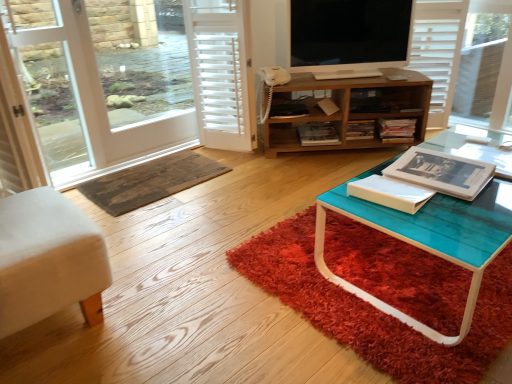
Find the location of a particular element. Image resolution: width=512 pixels, height=384 pixels. black glossy tv at upper center is located at coordinates (349, 33).

This screenshot has height=384, width=512. What do you see at coordinates (349, 33) in the screenshot?
I see `black glossy tv at upper center` at bounding box center [349, 33].

This screenshot has width=512, height=384. What do you see at coordinates (375, 309) in the screenshot? I see `shaggy red rug at lower center, marked as the first doormat in a front-to-back arrangement` at bounding box center [375, 309].

Locate an element on the screen. wooden textured doormat at center, which is the second doormat in front-to-back order is located at coordinates (150, 181).

The image size is (512, 384). Describe the element at coordinates (47, 259) in the screenshot. I see `white fabric cushion at lower left` at that location.

Identify the location of wooden cabinet at center. The height and width of the screenshot is (384, 512). (348, 109).

Between wooden textured doormat at center, which appears as the 1th doormat when viewed from the back, and black glossy tv at upper center, which one appears on the left side from the viewer's perspective?

wooden textured doormat at center, which appears as the 1th doormat when viewed from the back.

Are wooden textured doormat at center, marked as the first doormat in a left-to-right arrangement, and black glossy tv at upper center located far from each other?

Absolutely, wooden textured doormat at center, marked as the first doormat in a left-to-right arrangement, is distant from black glossy tv at upper center.

Is wooden textured doormat at center, which appears as the 1th doormat when viewed from the back, looking in the opposite direction of black glossy tv at upper center?

No, wooden textured doormat at center, which appears as the 1th doormat when viewed from the back, is not facing away from black glossy tv at upper center.

Is wooden textured doormat at center, the second doormat when ordered from right to left, positioned before black glossy tv at upper center?

Yes, the depth of wooden textured doormat at center, the second doormat when ordered from right to left, is less than that of black glossy tv at upper center.

Is transparent glass screen door at left wider than shaggy red rug at lower center, the first doormat positioned from the right?

No.

You are a GUI agent. You are given a task and a screenshot of the screen. Output one action in this format:
    pyautogui.click(x=<x>, y=<y>)
    Task: Click on the screen door that appears on the left of shaggy red rug at lower center, the first doormat positioned from the right
    
    Given the screenshot: What is the action you would take?
    pyautogui.click(x=48, y=84)

Between point (42, 25) and point (404, 283), which one is positioned in front?

The point (404, 283) is closer to the camera.

Is shaggy red rug at lower center, which is counted as the 2th doormat, starting from the back, surrounded by transparent glass screen door at left?

Actually, shaggy red rug at lower center, which is counted as the 2th doormat, starting from the back, is outside transparent glass screen door at left.

How many degrees apart are the facing directions of shaggy red rug at lower center, which is counted as the 2th doormat, starting from the back, and white fabric cushion at lower left?

The angle between the facing direction of shaggy red rug at lower center, which is counted as the 2th doormat, starting from the back, and the facing direction of white fabric cushion at lower left is 4.48 degrees.

Based on the photo, from the image's perspective, is shaggy red rug at lower center, marked as the first doormat in a front-to-back arrangement, on top of white fabric cushion at lower left?

Yes, from the image's perspective, shaggy red rug at lower center, marked as the first doormat in a front-to-back arrangement, is above white fabric cushion at lower left.

Does shaggy red rug at lower center, marked as the first doormat in a front-to-back arrangement, have a larger size compared to white fabric cushion at lower left?

Actually, shaggy red rug at lower center, marked as the first doormat in a front-to-back arrangement, might be smaller than white fabric cushion at lower left.

From a real-world perspective, between shaggy red rug at lower center, marked as the first doormat in a front-to-back arrangement, and white fabric cushion at lower left, who is vertically higher?

From a 3D spatial view, white fabric cushion at lower left is above.

Which is closer, (55, 193) or (358, 60)?

The point (55, 193) is closer.

Is white fabric cushion at lower left wider or thinner than black glossy tv at upper center?

In the image, white fabric cushion at lower left appears to be wider than black glossy tv at upper center.

From the image's perspective, is white fabric cushion at lower left above black glossy tv at upper center?

No, from the image's perspective, white fabric cushion at lower left is not over black glossy tv at upper center.

From a real-world perspective, is white fabric cushion at lower left under black glossy tv at upper center?

Yes.

Which object is further away from the camera taking this photo, black glossy tv at upper center or wooden cabinet at center?

wooden cabinet at center is behind.

Consider the image. Is black glossy tv at upper center facing towards wooden cabinet at center?

No, black glossy tv at upper center is not oriented towards wooden cabinet at center.

Which object is thinner, black glossy tv at upper center or wooden cabinet at center?

Thinner between the two is black glossy tv at upper center.

Can you tell me how much black glossy tv at upper center and wooden cabinet at center differ in facing direction?

The angular difference between black glossy tv at upper center and wooden cabinet at center is 1.94 degrees.

Considering the sizes of objects wooden cabinet at center and wooden textured doormat at center, marked as the first doormat in a left-to-right arrangement, in the image provided, who is shorter, wooden cabinet at center or wooden textured doormat at center, marked as the first doormat in a left-to-right arrangement,?

wooden textured doormat at center, marked as the first doormat in a left-to-right arrangement.

Does point (300, 99) come closer to viewer compared to point (142, 167)?

No, (300, 99) is behind (142, 167).

Is wooden cabinet at center positioned beyond the bounds of wooden textured doormat at center, marked as the first doormat in a left-to-right arrangement?

Indeed, wooden cabinet at center is completely outside wooden textured doormat at center, marked as the first doormat in a left-to-right arrangement.

How different are the orientations of transparent glass screen door at left and black glossy tv at upper center in degrees?

There is a 39-degree angle between the facing directions of transparent glass screen door at left and black glossy tv at upper center.

Is point (67, 41) behind point (374, 7)?

No.

Based on their positions, is transparent glass screen door at left located to the left or right of black glossy tv at upper center?

Based on their positions, transparent glass screen door at left is located to the left of black glossy tv at upper center.

Is the depth of transparent glass screen door at left less than that of black glossy tv at upper center?

Yes, it is in front of black glossy tv at upper center.

Locate an element on the screen. The width and height of the screenshot is (512, 384). television lying behind the wooden textured doormat at center, the second doormat when ordered from right to left is located at coordinates (349, 33).

The width and height of the screenshot is (512, 384). There is a transparent glass screen door at left. In order to click on the 2nd doormat below it (from the image's perspective) in this screenshot , I will do `click(375, 309)`.

Considering their positions, is wooden cabinet at center positioned closer to shaggy red rug at lower center, marked as the first doormat in a front-to-back arrangement, than transparent glass screen door at left?

Among the two, wooden cabinet at center is located nearer to shaggy red rug at lower center, marked as the first doormat in a front-to-back arrangement.

Considering their positions, is wooden textured doormat at center, which is the second doormat in front-to-back order, positioned further to white fabric cushion at lower left than black glossy tv at upper center?

black glossy tv at upper center is further to white fabric cushion at lower left.

Estimate the real-world distances between objects in this image. Which object is closer to shaggy red rug at lower center, which is counted as the 2th doormat, starting from the back, black glossy tv at upper center or transparent glass screen door at left?

black glossy tv at upper center is positioned closer to the anchor shaggy red rug at lower center, which is counted as the 2th doormat, starting from the back.

Which object lies nearer to the anchor point black glossy tv at upper center, transparent glass screen door at left or wooden cabinet at center?

Among the two, wooden cabinet at center is located nearer to black glossy tv at upper center.

Which object lies nearer to the anchor point wooden cabinet at center, white fabric cushion at lower left or black glossy tv at upper center?

The object closer to wooden cabinet at center is black glossy tv at upper center.

Looking at the image, which one is located further to wooden textured doormat at center, the second doormat when ordered from right to left, white fabric cushion at lower left or transparent glass screen door at left?

Based on the image, white fabric cushion at lower left appears to be further to wooden textured doormat at center, the second doormat when ordered from right to left.

Looking at the image, which one is located further to transparent glass screen door at left, black glossy tv at upper center or white fabric cushion at lower left?

Based on the image, black glossy tv at upper center appears to be further to transparent glass screen door at left.

Consider the image. From the image, which object appears to be nearer to black glossy tv at upper center, white fabric cushion at lower left or transparent glass screen door at left?

transparent glass screen door at left is positioned closer to the anchor black glossy tv at upper center.

Image resolution: width=512 pixels, height=384 pixels. I want to click on doormat located between transparent glass screen door at left and shaggy red rug at lower center, marked as the first doormat in a front-to-back arrangement, in the left-right direction, so click(150, 181).

Image resolution: width=512 pixels, height=384 pixels. What are the coordinates of `doormat between shaggy red rug at lower center, the first doormat positioned from the right, and wooden cabinet at center from front to back` in the screenshot? It's located at (150, 181).

I want to click on television positioned between white fabric cushion at lower left and wooden cabinet at center from near to far, so click(x=349, y=33).

I want to click on doormat between shaggy red rug at lower center, the second doormat from the left, and black glossy tv at upper center, along the z-axis, so click(150, 181).